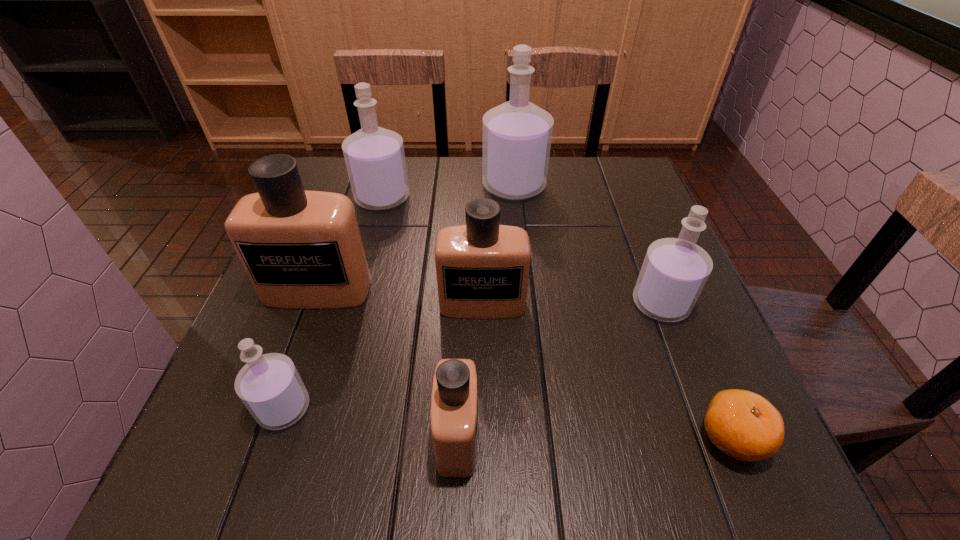
What are the coordinates of `free space between the second biggest beige perfume and the smallest purple perfume` in the screenshot? It's located at (383, 355).

The width and height of the screenshot is (960, 540). Find the location of `vacant space that is in between the second biggest purple perfume and the smallest beige perfume`. vacant space that is in between the second biggest purple perfume and the smallest beige perfume is located at coordinates (420, 317).

Identify the location of free space between the smallest beige perfume and the orange clementine. (595, 436).

The width and height of the screenshot is (960, 540). Find the location of `free space between the smallest purple perfume and the smallest beige perfume`. free space between the smallest purple perfume and the smallest beige perfume is located at coordinates point(371,422).

Locate an element on the screen. The height and width of the screenshot is (540, 960). empty space between the nearest beige perfume and the rightmost perfume is located at coordinates (559, 370).

Find the location of a particular element. The height and width of the screenshot is (540, 960). object that ranks as the third closest to the leftmost beige perfume is located at coordinates (374, 156).

Select which object appears as the sixth closest to the second biggest beige perfume. Please provide its 2D coordinates. Your answer should be formatted as a tuple, i.e. [(x, y)], where the tuple contains the x and y coordinates of a point satisfying the conditions above.

[(517, 135)]

Identify which perfume is the second closest to the leftmost beige perfume. Please provide its 2D coordinates. Your answer should be formatted as a tuple, i.e. [(x, y)], where the tuple contains the x and y coordinates of a point satisfying the conditions above.

[(269, 385)]

Identify the location of the fifth closest perfume relative to the tallest perfume. (454, 401).

Where is `purple perfume that is the fourth closest to the leftmost beige perfume`? This screenshot has width=960, height=540. purple perfume that is the fourth closest to the leftmost beige perfume is located at coordinates (675, 270).